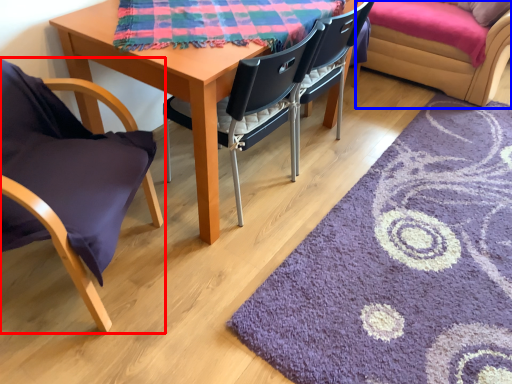
Question: Which of the following is the closest to the observer, chair (highlighted by a red box) or couch (highlighted by a blue box)?

Choices:
 (A) chair
 (B) couch

Answer: (A)